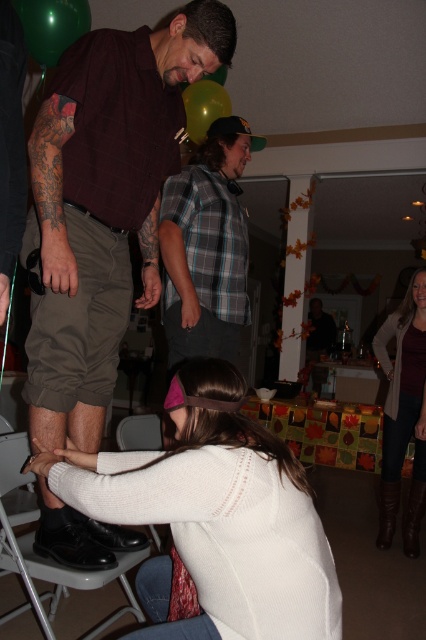
From the picture: You are a photographer standing at the camera position. You want to take a photo of the white knit sweater at lower center without moving the sweater. Can you adjust your camera zoom to focus on it clearly?

The white knit sweater at lower center is 1.13 meters away from the camera. Since this distance is within typical camera focusing range, adjusting the zoom should allow clear focus on the white knit sweater at lower center.

You are at the point labeled point (0, 506) and want to move to the point labeled point (193, 132). Which direction should you move to reach your destination?

To move from point (0, 506) to point (193, 132), you should move backward since point (0, 506) is in front of point (193, 132).